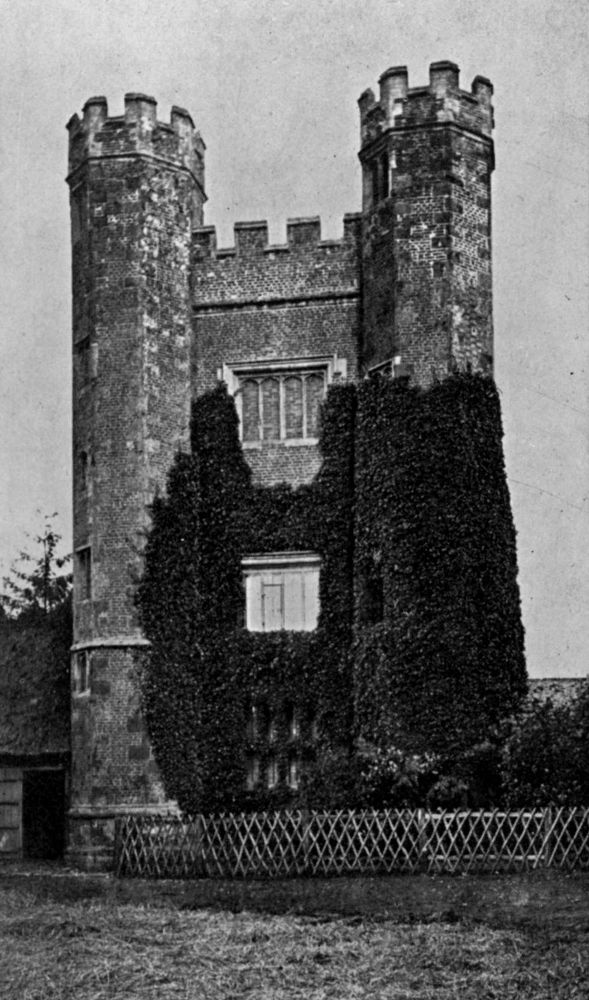
Identify the location of door. The width and height of the screenshot is (589, 1000). [x=44, y=804].